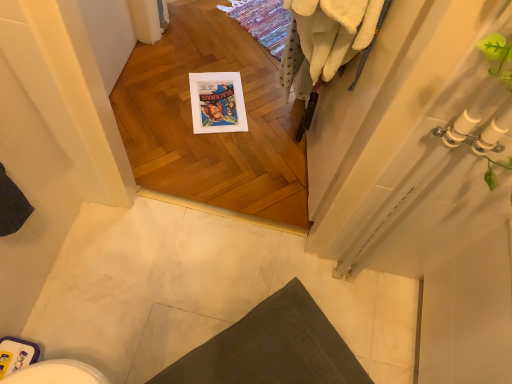
Locate an element on the screen. free point above dark gray fabric bath mat at lower center (from a real-world perspective) is located at coordinates (283, 350).